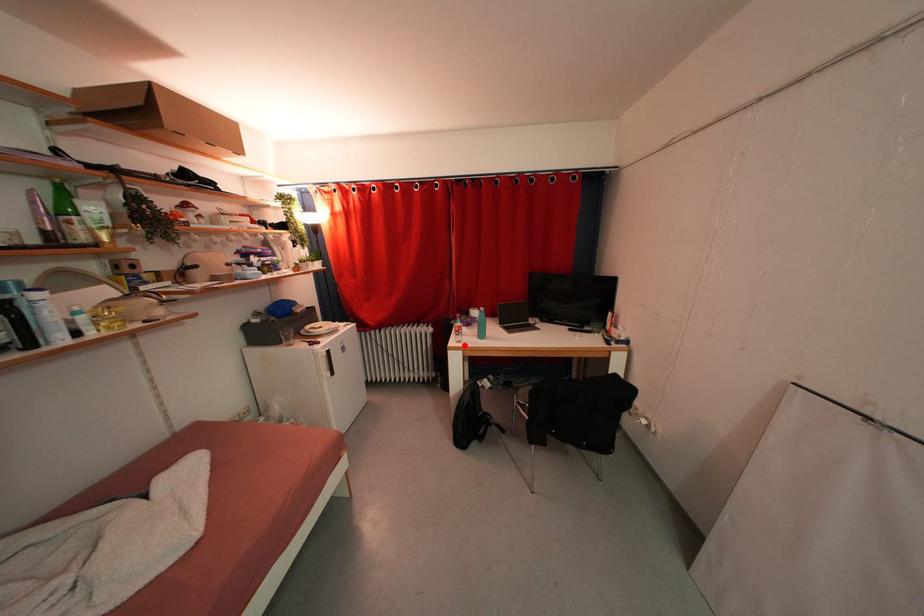
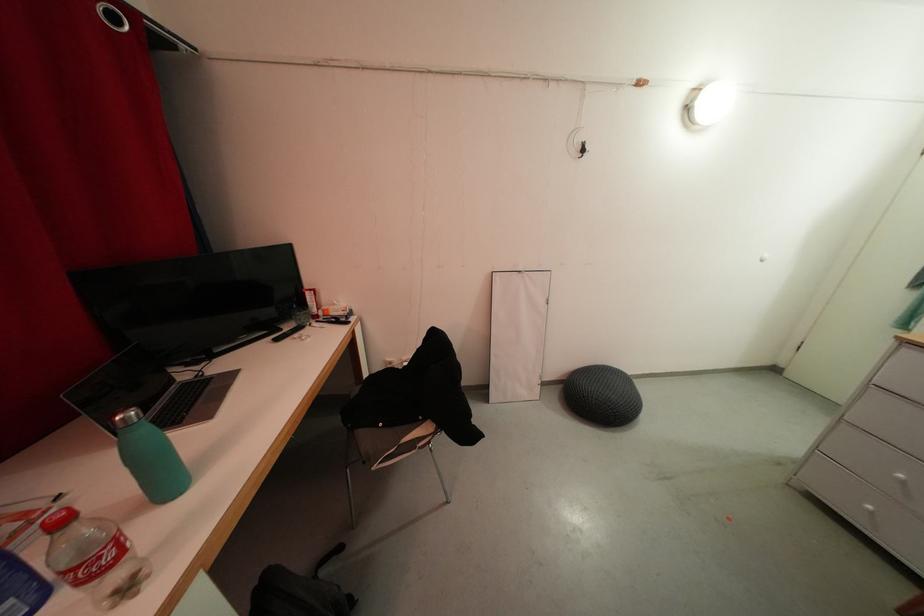
Question: I am providing you with two images of the same scene from different viewpoints. A red point is shown in image1. For the corresponding object point in image2, is it positioned nearer or farther from the camera?

Choices:
 (A) Nearer
 (B) Farther

Answer: (A)